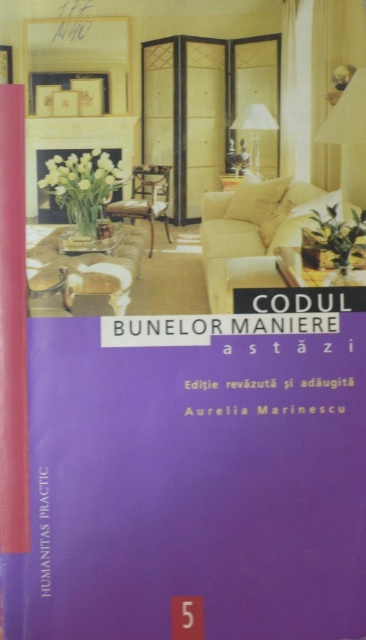
You are standing in the living room depicted on the book cover. You see two points marked in the scene. The first point is at coordinate point (120, 275) and the second is at point (303, 253). Which point is closer to you?

Point (120, 275) is in front of point (303, 253), so it is closer to you.

You are looking at the book cover and see both the clear glass table at center and the wooden table at center. Which one appears nearer to you?

The clear glass table at center is closer to the viewer than the wooden table at center.

You have a small decorative item that is 10 cm wide. You want to place it on the clear glass table at center. Considering the purple matte book at center is already there, can the item fit on the table without overlapping the book?

The purple matte book at center is wider than the clear glass table at center, so placing a 10 cm wide item might not be possible without overlapping since the book itself already occupies most of the table space.